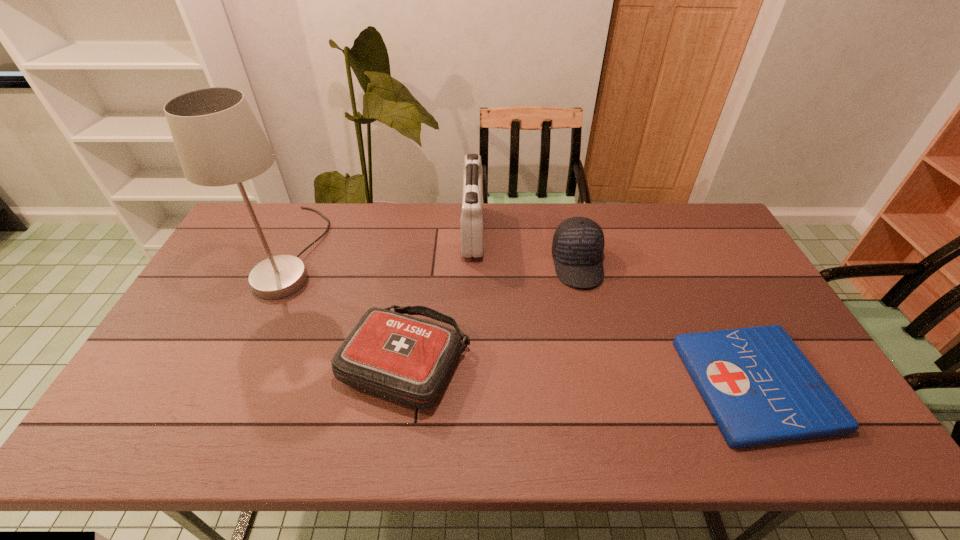
The height and width of the screenshot is (540, 960). Identify the location of object situated at the near right corner. (759, 387).

At what (x,y) coordinates should I click in order to perform the action: click on free space at the far edge of the desktop. Please return your answer as a coordinate pair (x, y). Looking at the image, I should click on (436, 221).

Identify the location of vacant position at the near edge of the desktop. [x=392, y=433].

The image size is (960, 540). Identify the location of free location at the left edge. (227, 322).

Locate an element on the screen. The height and width of the screenshot is (540, 960). free space at the near left corner of the desktop is located at coordinates (110, 437).

Identify the location of free space at the far right corner. (720, 224).

At what (x,y) coordinates should I click in order to perform the action: click on vacant region between the third tallest object and the second shortest first-aid kit. Please return your answer as a coordinate pair (x, y). This screenshot has height=540, width=960. Looking at the image, I should click on (492, 313).

Where is `empty space that is in between the fourth shortest object and the rightmost object`? This screenshot has height=540, width=960. empty space that is in between the fourth shortest object and the rightmost object is located at coordinates (613, 308).

Identify the location of free area in between the fourth tallest object and the fourth object from left to right. The height and width of the screenshot is (540, 960). (492, 313).

Locate an element on the screen. The width and height of the screenshot is (960, 540). empty space that is in between the fourth tallest object and the shortest object is located at coordinates (580, 373).